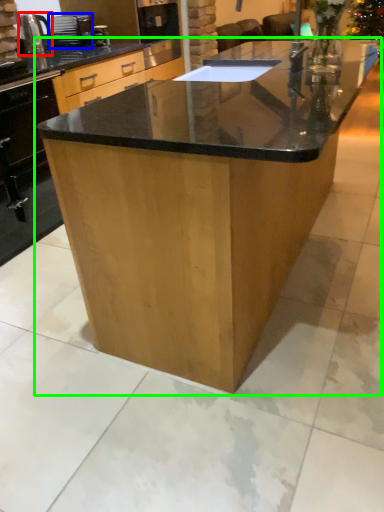
Question: Based on their relative distances, which object is farther from kitchen appliance (highlighted by a red box)? Choose from appliance (highlighted by a blue box) and table (highlighted by a green box).

Choices:
 (A) appliance
 (B) table

Answer: (B)